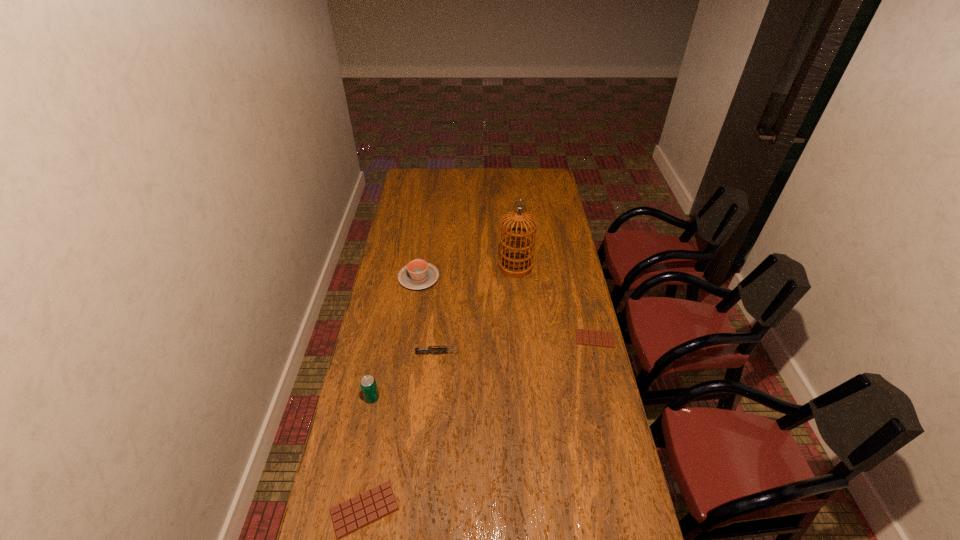
If we want them evenly spaced by inserting an extra candy_bar among them, please locate a free spot for this new candy_bar. Please provide its 2D coordinates. Your answer should be formatted as a tuple, i.e. [(x, y)], where the tuple contains the x and y coordinates of a point satisfying the conditions above.

[(497, 411)]